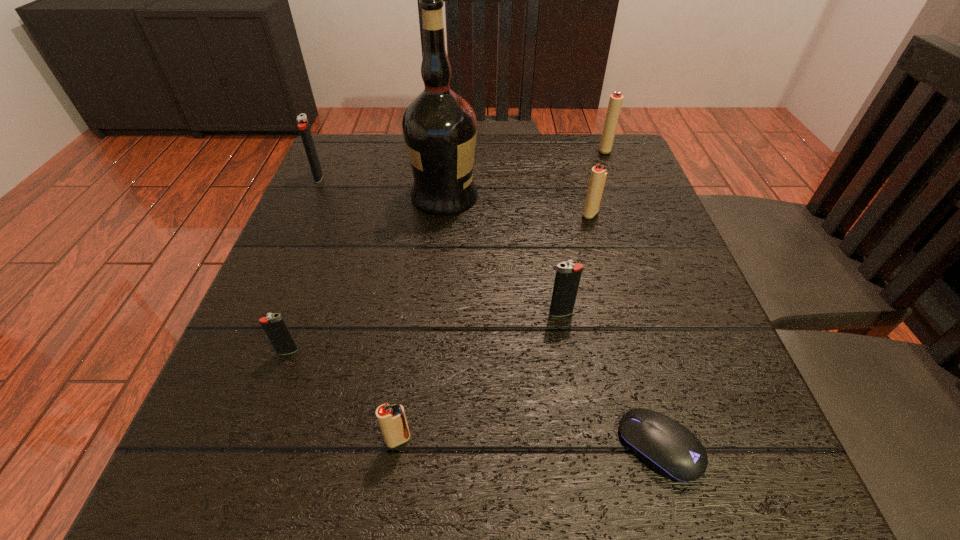
You are a GUI agent. You are given a task and a screenshot of the screen. Output one action in this format:
    pyautogui.click(x=<x>, y=<y>)
    Task: Click on the red igniter that can be found as the second closest to the farthest black igniter
    This screenshot has height=540, width=960.
    Given the screenshot: What is the action you would take?
    pyautogui.click(x=392, y=419)

Locate which black igniter ranks second in proximity to the second black igniter from right to left. Please provide its 2D coordinates. Your answer should be formatted as a tuple, i.e. [(x, y)], where the tuple contains the x and y coordinates of a point satisfying the conditions above.

[(303, 126)]

Point out which black igniter is positioned as the nearest to the tallest object. Please provide its 2D coordinates. Your answer should be formatted as a tuple, i.e. [(x, y)], where the tuple contains the x and y coordinates of a point satisfying the conditions above.

[(303, 126)]

The image size is (960, 540). Identify the location of vacant point that satisfies the following two spatial constraints: 1. on the back side of the biggest red igniter; 2. on the right side of the computer mouse. (574, 150).

Locate an element on the screen. free space that satisfies the following two spatial constraints: 1. on the back side of the fourth igniter from left to right; 2. on the surface of the liquor is located at coordinates (541, 195).

Image resolution: width=960 pixels, height=540 pixels. In order to click on free space in the image that satisfies the following two spatial constraints: 1. on the surface of the rightmost black igniter; 2. on the right side of the liquor in this screenshot , I will do `click(434, 313)`.